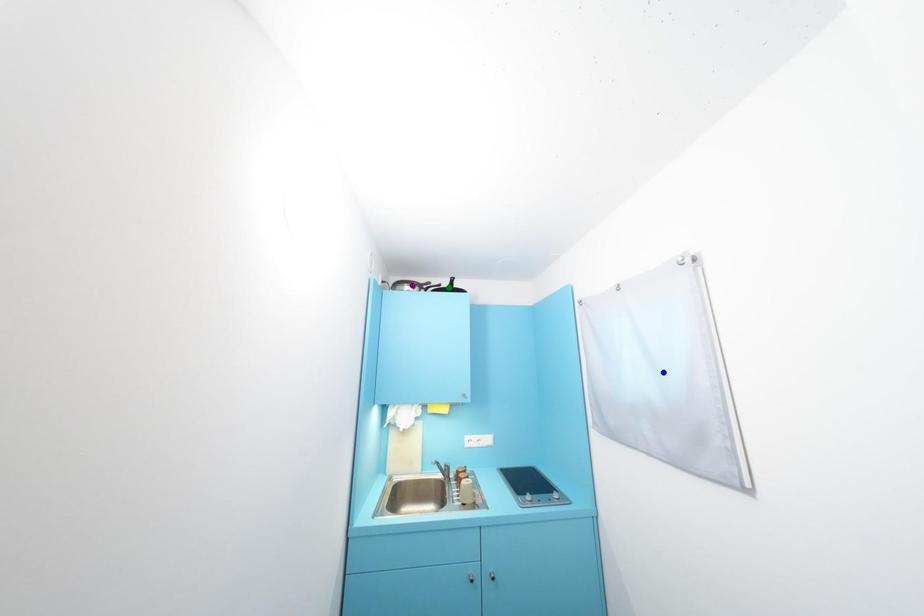
Order these from nearest to farthest:
- purple point
- green point
- blue point

1. blue point
2. green point
3. purple point